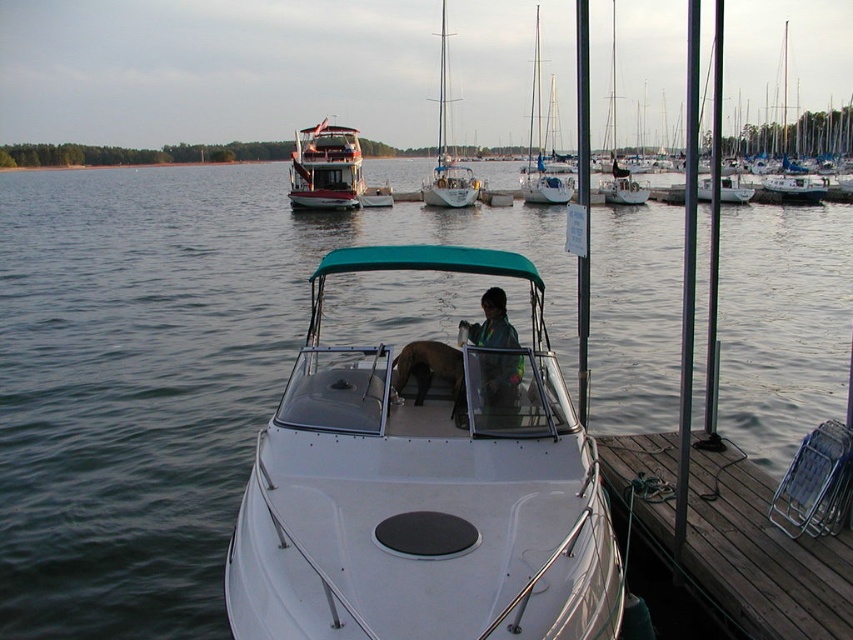
In the scene shown: You are planning to take a short trip on the lake and have to choose between the white glossy boat at center and the white glossy sailboat at upper right. Based on their sizes, which one would you recommend for a more spacious experience?

The white glossy sailboat at upper right is larger than the white glossy boat at center, so it would provide a more spacious experience for your trip.

You are standing on the wooden pier and want to board the white glossy boat at center. Is the white glossy sailboat at upper right blocking your path to the boat?

The white glossy boat at center is positioned under the white glossy sailboat at upper right, so the sailboat is above the boat. Since you are on the pier, you can walk around the white glossy sailboat at upper right to reach the boat below without obstruction.